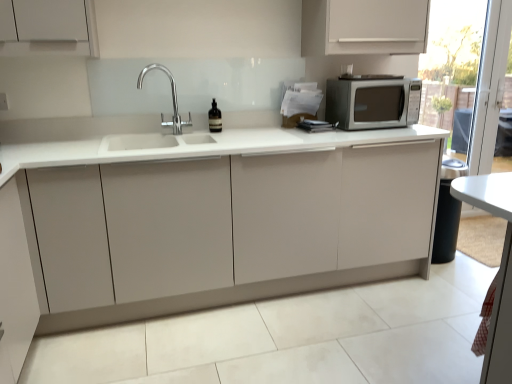
Question: Considering the relative positions of matte white cabinet at center and white glossy table at lower right in the image provided, is matte white cabinet at center to the right of white glossy table at lower right from the viewer's perspective?

Choices:
 (A) no
 (B) yes

Answer: (A)

Question: Does matte white cabinet at center have a smaller size compared to white glossy table at lower right?

Choices:
 (A) no
 (B) yes

Answer: (A)

Question: From the image's perspective, is matte white cabinet at center beneath white glossy table at lower right?

Choices:
 (A) yes
 (B) no

Answer: (B)

Question: Is matte white cabinet at center oriented towards white glossy table at lower right?

Choices:
 (A) yes
 (B) no

Answer: (A)

Question: From a real-world perspective, is matte white cabinet at center below white glossy table at lower right?

Choices:
 (A) yes
 (B) no

Answer: (A)

Question: Can you confirm if matte white cabinet at center is shorter than white glossy table at lower right?

Choices:
 (A) no
 (B) yes

Answer: (A)

Question: Does brown glass bottle at center have a larger size compared to transparent glass screen door at right?

Choices:
 (A) yes
 (B) no

Answer: (B)

Question: Does brown glass bottle at center have a lesser height compared to transparent glass screen door at right?

Choices:
 (A) yes
 (B) no

Answer: (A)

Question: Is brown glass bottle at center facing away from transparent glass screen door at right?

Choices:
 (A) yes
 (B) no

Answer: (B)

Question: Considering the relative sizes of brown glass bottle at center and transparent glass screen door at right in the image provided, is brown glass bottle at center wider than transparent glass screen door at right?

Choices:
 (A) no
 (B) yes

Answer: (B)

Question: Is brown glass bottle at center smaller than transparent glass screen door at right?

Choices:
 (A) no
 (B) yes

Answer: (B)

Question: Does brown glass bottle at center turn towards transparent glass screen door at right?

Choices:
 (A) no
 (B) yes

Answer: (A)

Question: Is matte white cabinet at center shorter than transparent glass screen door at right?

Choices:
 (A) yes
 (B) no

Answer: (A)